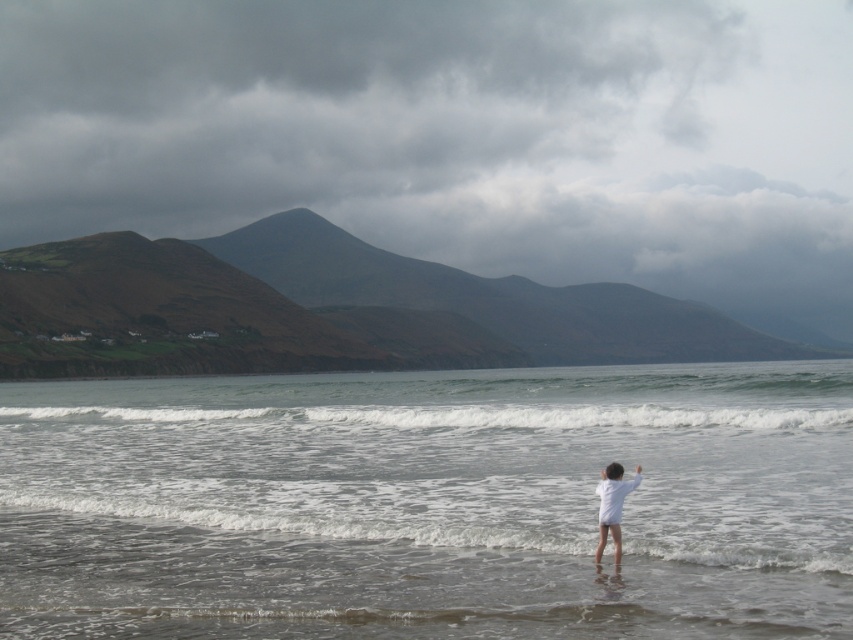
Who is more forward, (506, 426) or (601, 538)?

Positioned in front is point (601, 538).

Who is shorter, white foamy wave at center or white matte shirt at lower right?

white matte shirt at lower right

Which is in front, point (482, 413) or point (598, 545)?

Point (598, 545)

You are a GUI agent. You are given a task and a screenshot of the screen. Output one action in this format:
    pyautogui.click(x=<x>, y=<y>)
    Task: Click on the white foamy wave at center
    The image size is (853, 640).
    Given the screenshot: What is the action you would take?
    pyautogui.click(x=456, y=416)

Is clear water at lower center behind white foamy wave at center?

No, it is not.

Does clear water at lower center have a smaller size compared to white foamy wave at center?

No, clear water at lower center is not smaller than white foamy wave at center.

Where is `clear water at lower center`? The width and height of the screenshot is (853, 640). clear water at lower center is located at coordinates (428, 502).

Measure the distance between clear water at lower center and camera.

clear water at lower center and camera are 12.19 meters apart from each other.

Which is in front, point (589, 577) or point (605, 532)?

Point (589, 577)

Where is `clear water at lower center`? clear water at lower center is located at coordinates (428, 502).